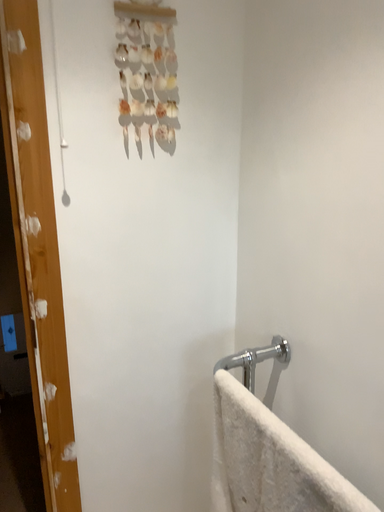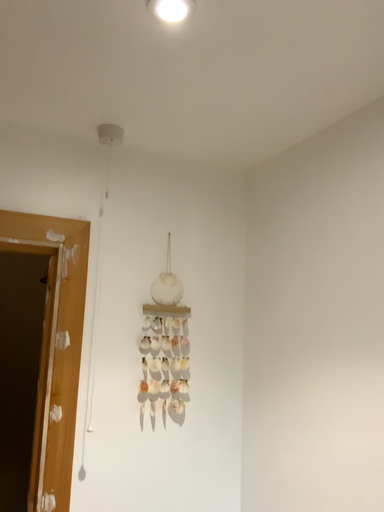
Question: How did the camera likely rotate when shooting the video?

Choices:
 (A) rotated downward
 (B) rotated upward

Answer: (B)